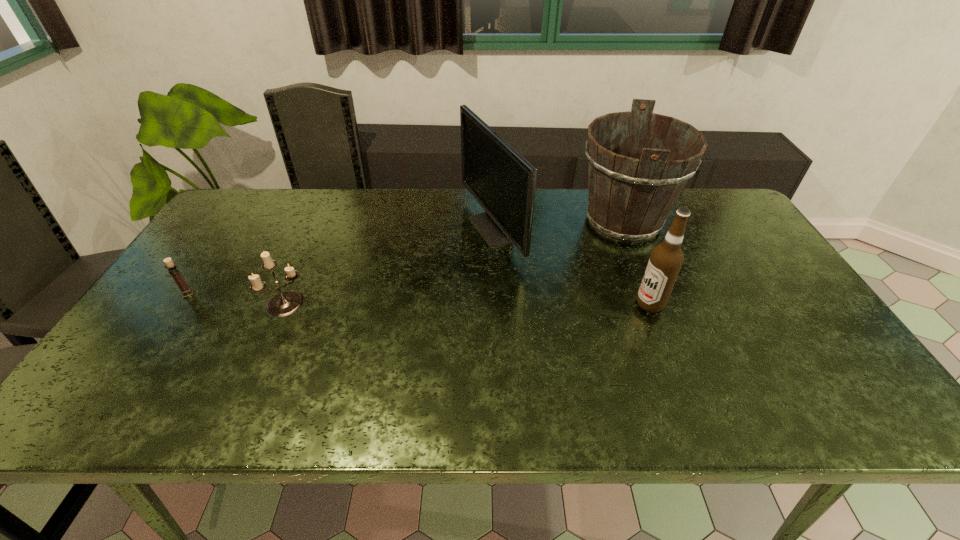
Identify the location of free space between the shorter candle holder and the right candle holder. This screenshot has height=540, width=960. (238, 299).

The width and height of the screenshot is (960, 540). Find the location of `empty space between the computer monitor and the shorter candle holder`. empty space between the computer monitor and the shorter candle holder is located at coordinates (340, 261).

At what (x,y) coordinates should I click in order to perform the action: click on free space between the alcohol and the bucket. Please return your answer as a coordinate pair (x, y). Image resolution: width=960 pixels, height=540 pixels. Looking at the image, I should click on (636, 263).

Find the location of a particular element. blank region between the alcohol and the left candle holder is located at coordinates (419, 299).

Where is `object that is the nearest to the alcohol`? This screenshot has width=960, height=540. object that is the nearest to the alcohol is located at coordinates click(638, 162).

Select which object is the second closest to the bucket. Please provide its 2D coordinates. Your answer should be formatted as a tuple, i.e. [(x, y)], where the tuple contains the x and y coordinates of a point satisfying the conditions above.

[(503, 182)]

Image resolution: width=960 pixels, height=540 pixels. Find the location of `vacant space that satisfies the following two spatial constraints: 1. on the front side of the right candle holder; 2. on the left side of the shorter candle holder`. vacant space that satisfies the following two spatial constraints: 1. on the front side of the right candle holder; 2. on the left side of the shorter candle holder is located at coordinates (181, 303).

The height and width of the screenshot is (540, 960). Identify the location of free space that satisfies the following two spatial constraints: 1. on the back side of the bucket; 2. on the right side of the right candle holder. (324, 222).

The height and width of the screenshot is (540, 960). I want to click on free spot that satisfies the following two spatial constraints: 1. on the front side of the bucket; 2. on the front-facing side of the computer monitor, so click(626, 230).

Locate an element on the screen. The image size is (960, 540). vacant region that satisfies the following two spatial constraints: 1. on the back side of the right candle holder; 2. on the right side of the bucket is located at coordinates (324, 222).